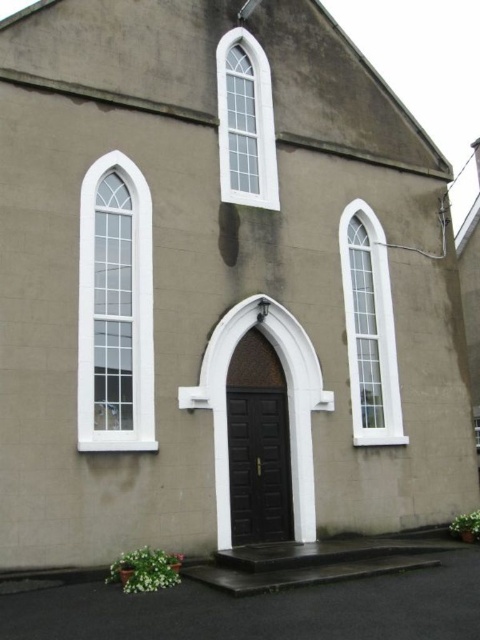
You are standing in front of the building and want to take a photo. You notice two points marked on the building. The first point is at coordinate point (369,413) and the second is at point (227,60). Which point will appear larger in your photo?

Point (369,413) is closer to the camera than point (227,60), so it will appear larger in the photo.

You are standing in front of the building and want to know how far you are from the point marked at coordinates point (117, 381). Can you determine the distance?

The point marked at coordinates point (117, 381) is 29.08 meters away from your current position.

You are standing at point A located at point (90, 413) and want to walk to point B which is 27.75 meters away. The path between them is straight and clear. If you walk at a constant speed of 1.5 meters per second, how many seconds will it take you to reach point B?

The distance between point A and point B is 27.75 meters. Walking at 1.5 meters per second, the time required is 27.75 divided by 1.5, which equals 18.5 seconds. Therefore, it will take 18.5 seconds to reach point B.